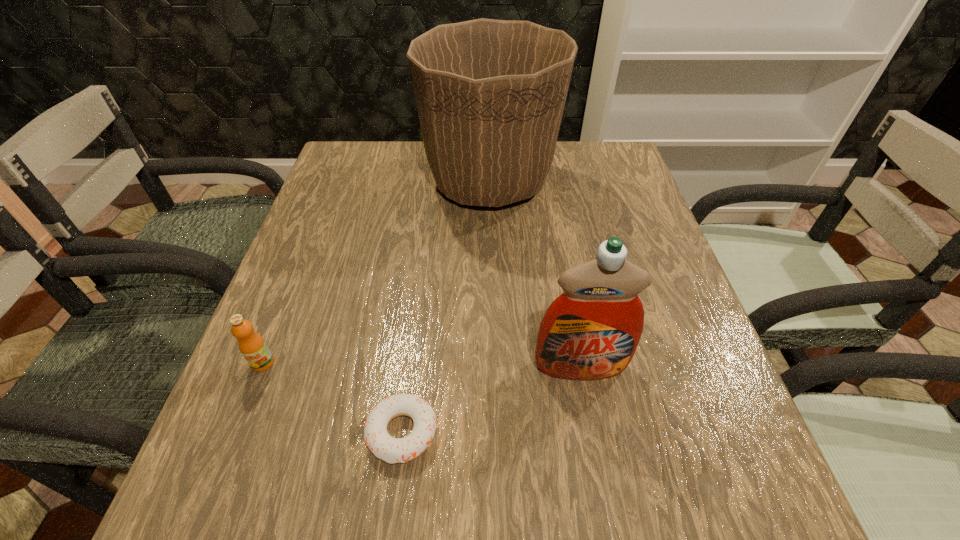
Find the location of a particular element. empty space that is in between the third tallest object and the shortest object is located at coordinates (332, 397).

Image resolution: width=960 pixels, height=540 pixels. I want to click on free space between the second shortest object and the doughnut, so click(x=332, y=397).

What are the coordinates of `free space between the second shortest object and the farthest object` in the screenshot? It's located at (376, 272).

This screenshot has height=540, width=960. In order to click on vacant space that's between the detergent and the nearest object in this screenshot , I will do `click(492, 399)`.

Where is `free space between the detergent and the nearest object`? free space between the detergent and the nearest object is located at coordinates (492, 399).

This screenshot has height=540, width=960. What are the coordinates of `free space between the tallest object and the third shortest object` in the screenshot? It's located at (535, 274).

You are a GUI agent. You are given a task and a screenshot of the screen. Output one action in this format:
    pyautogui.click(x=<x>, y=<y>)
    Task: Click on the vacant space in between the second tallest object and the nearest object
    This screenshot has height=540, width=960.
    Given the screenshot: What is the action you would take?
    492,399

You are a GUI agent. You are given a task and a screenshot of the screen. Output one action in this format:
    pyautogui.click(x=<x>, y=<y>)
    Task: Click on the free space between the second shortest object and the nearest object
    
    Given the screenshot: What is the action you would take?
    pyautogui.click(x=332, y=397)

This screenshot has width=960, height=540. Identify the location of vacant space in between the third tallest object and the shortest object. (332, 397).

Find the location of `free space between the detergent and the shortest object`. free space between the detergent and the shortest object is located at coordinates (492, 399).